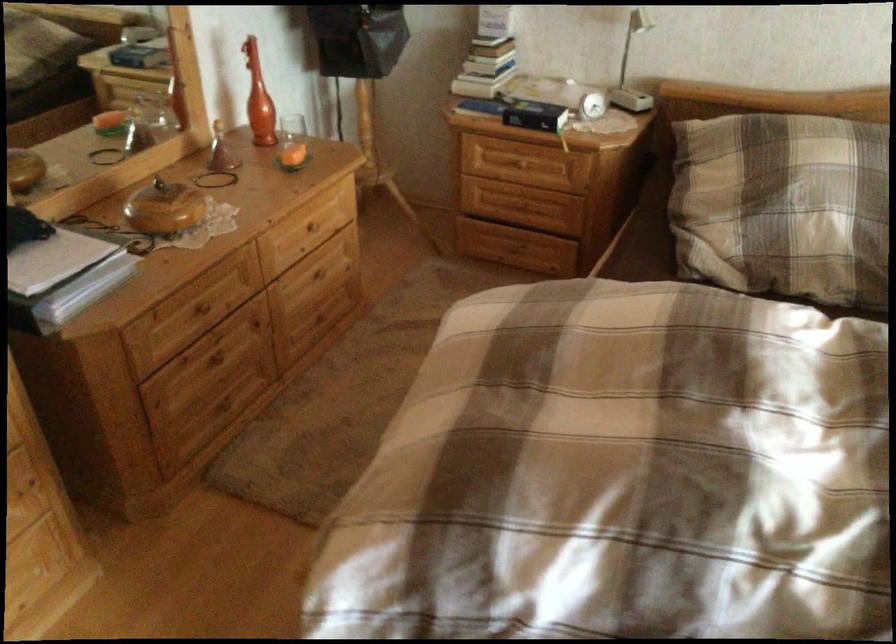
The location [535,115] corresponds to which object?

This point indicates the black binder.